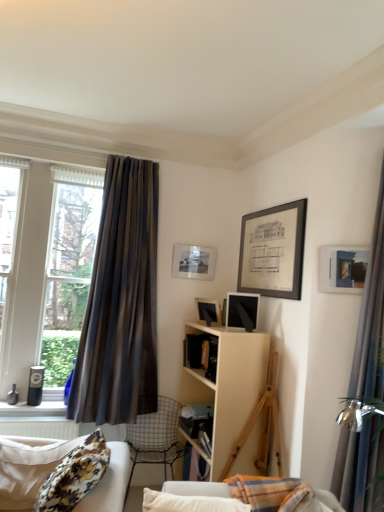
Question: From a real-world perspective, does matte black picture frame at center, the second picture frame from the left, sit lower than brown striped curtain at left, which is the second curtain in front-to-back order?

Choices:
 (A) yes
 (B) no

Answer: (A)

Question: Is matte black picture frame at center, arranged as the 2th picture frame when viewed from the right, beside brown striped curtain at left, which is the second curtain in front-to-back order?

Choices:
 (A) no
 (B) yes

Answer: (A)

Question: Is matte black picture frame at center, positioned as the second picture frame in front-to-back order, smaller than brown striped curtain at left, which ranks as the 2th curtain in right-to-left order?

Choices:
 (A) yes
 (B) no

Answer: (A)

Question: From a real-world perspective, is matte black picture frame at center, arranged as the 2th picture frame when viewed from the right, positioned over brown striped curtain at left, which ranks as the 2th curtain in right-to-left order, based on gravity?

Choices:
 (A) yes
 (B) no

Answer: (B)

Question: Is matte black picture frame at center, which is counted as the second picture frame, starting from the back, at the left side of brown striped curtain at left, the 1th curtain in the left-to-right sequence?

Choices:
 (A) yes
 (B) no

Answer: (B)

Question: Can you confirm if matte black picture frame at center, the second picture frame from the left, is wider than brown striped curtain at left, which ranks as the 2th curtain in right-to-left order?

Choices:
 (A) yes
 (B) no

Answer: (B)

Question: Could you tell me if silky blue curtain at right, the 1th curtain from the front, is facing floral fabric studio couch at lower left?

Choices:
 (A) yes
 (B) no

Answer: (B)

Question: Is silky blue curtain at right, acting as the second curtain starting from the back, not near floral fabric studio couch at lower left?

Choices:
 (A) yes
 (B) no

Answer: (A)

Question: From the image's perspective, does silky blue curtain at right, acting as the second curtain starting from the back, appear higher than floral fabric studio couch at lower left?

Choices:
 (A) yes
 (B) no

Answer: (A)

Question: Considering the relative sizes of silky blue curtain at right, the 1th curtain from the front, and floral fabric studio couch at lower left in the image provided, is silky blue curtain at right, the 1th curtain from the front, wider than floral fabric studio couch at lower left?

Choices:
 (A) no
 (B) yes

Answer: (A)

Question: Is silky blue curtain at right, the second curtain from the left, closer to camera compared to floral fabric studio couch at lower left?

Choices:
 (A) no
 (B) yes

Answer: (A)

Question: Are silky blue curtain at right, acting as the second curtain starting from the back, and floral fabric studio couch at lower left beside each other?

Choices:
 (A) yes
 (B) no

Answer: (B)

Question: From the image's perspective, is metallic wire chair at lower center on top of matte glass picture frame at upper center, positioned as the 3th picture frame in front-to-back order?

Choices:
 (A) yes
 (B) no

Answer: (B)